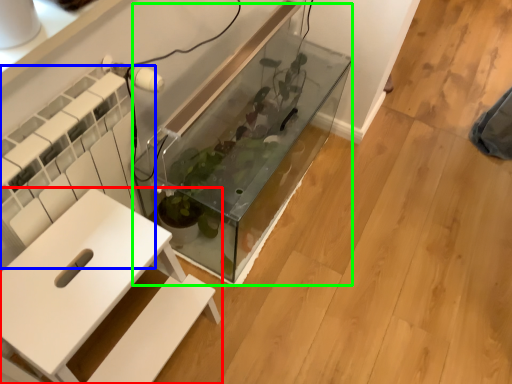
Question: Which object is positioned farthest from furniture (highlighted by a red box)? Select from radiator (highlighted by a blue box) and glass box (highlighted by a green box).

Choices:
 (A) radiator
 (B) glass box

Answer: (B)